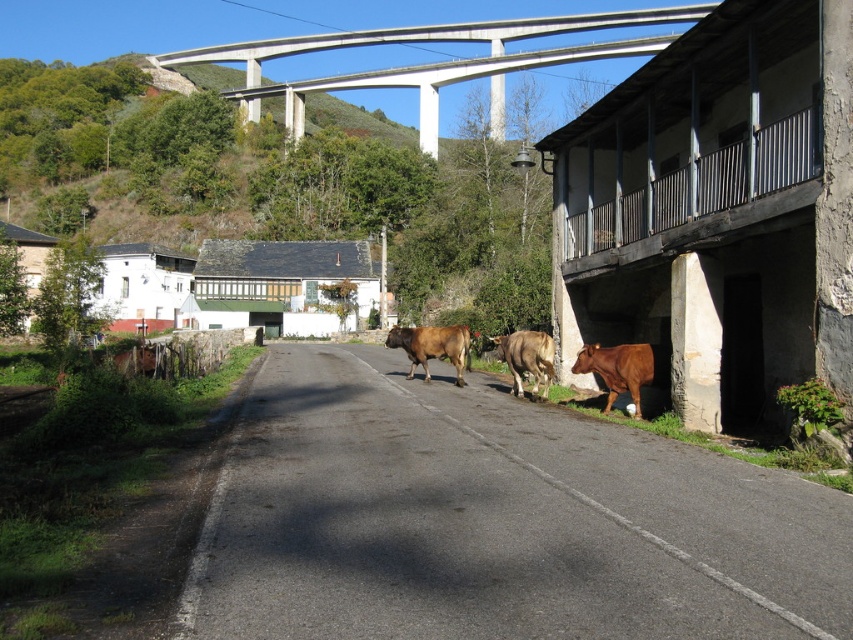
Question: Is concrete at upper center to the left of brown matte bull at right from the viewer's perspective?

Choices:
 (A) yes
 (B) no

Answer: (A)

Question: Among these points, which one is nearest to the camera?

Choices:
 (A) (407, 372)
 (B) (637, 368)

Answer: (B)

Question: Is concrete at upper center positioned at the back of brown matte bull at right?

Choices:
 (A) yes
 (B) no

Answer: (A)

Question: Where is concrete at upper center located in relation to brown matte bull at right in the image?

Choices:
 (A) above
 (B) below

Answer: (A)

Question: Which is nearer to the brown glossy bull at center?

Choices:
 (A) concrete at upper center
 (B) brown matte bull at right

Answer: (B)

Question: Which of these objects is positioned farthest from the brown glossy bull at center?

Choices:
 (A) concrete at upper center
 (B) brown matte bull at right
 (C) brown matte bull at center

Answer: (A)